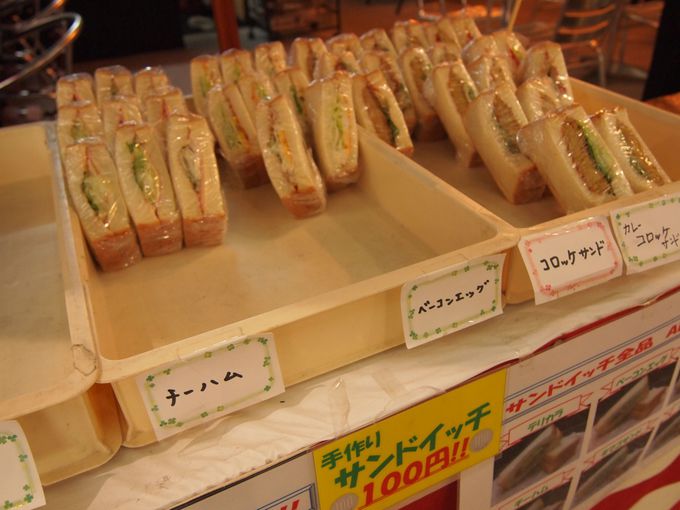
Identify the location of chair. The height and width of the screenshot is (510, 680). (549, 10).